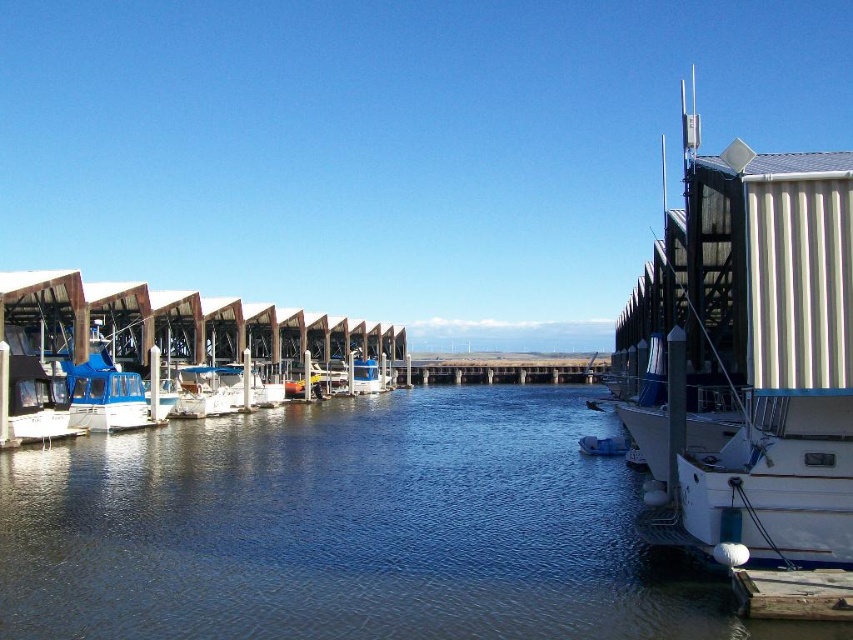
You are standing at the edge of the wooden dock at lower right and want to cross to the other side of the blue water at center. Can you walk directly across the water to reach the opposite side?

The blue water at center is larger in size than wooden dock at lower right, but since water cannot be walked on, you cannot cross directly. You need to find a boat or bridge.

You are standing at the edge of the marina and see the blue water at center and the concrete at center. Which surface is above the other?

The blue water at center is positioned over concrete at center, so the water is above the concrete.

You are standing at the center of the marina and want to locate the blue glossy boat at left. According to the coordinate system where the bottom left corner is the origin, what are its coordinates?

The blue glossy boat at left is located at coordinates point (106, 394).